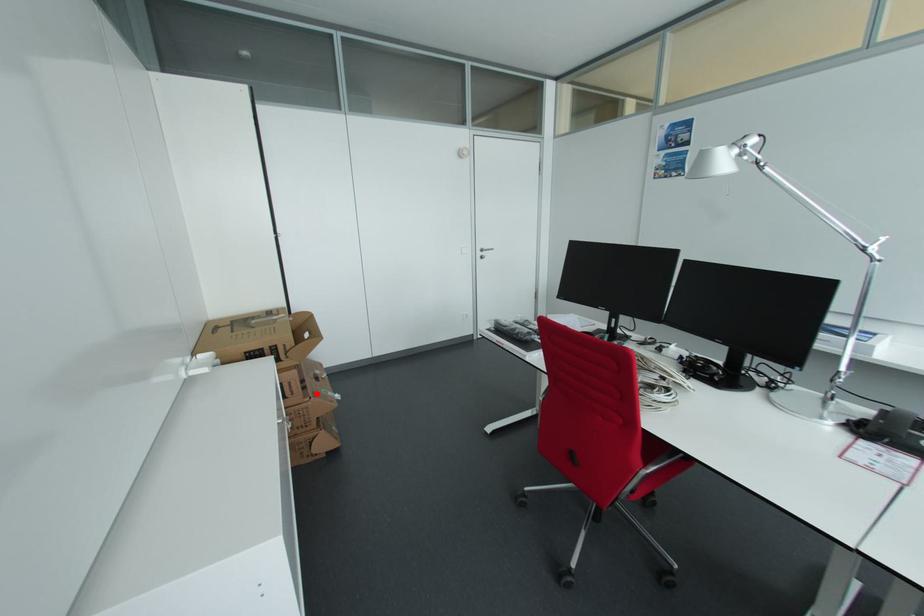
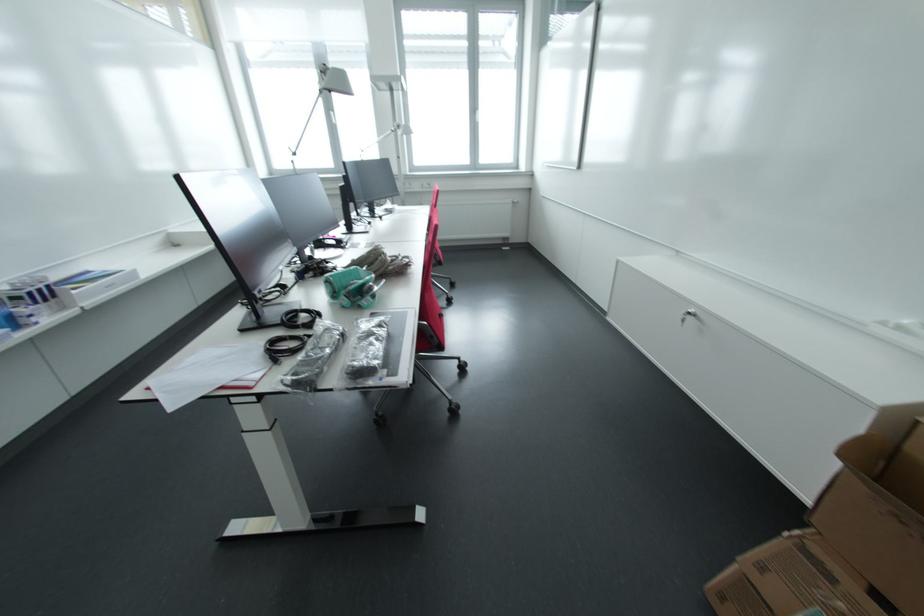
The point at the highlighted location is marked in the first image. Where is the corresponding point in the second image?

(833, 578)